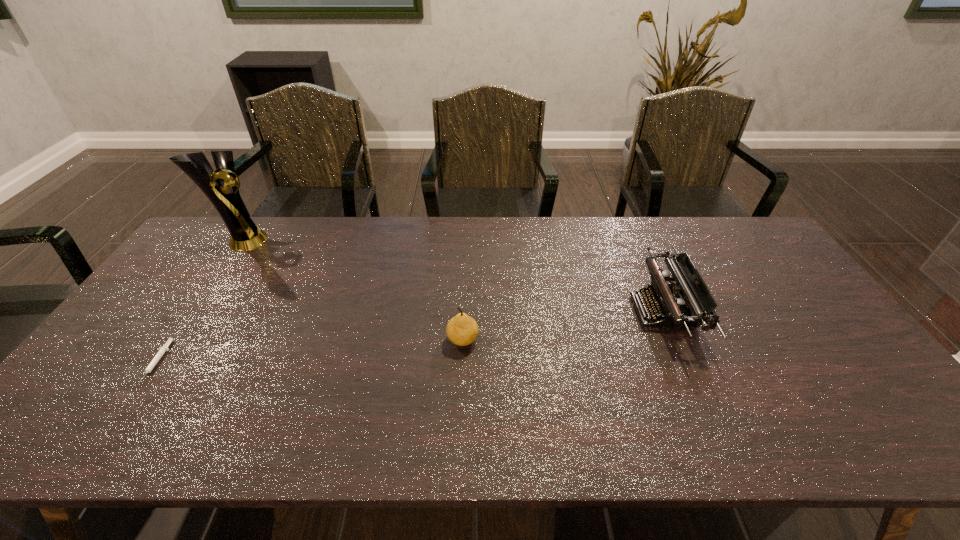
The image size is (960, 540). What are the coordinates of `award` in the screenshot? It's located at (244, 235).

What are the coordinates of `the tallest object` in the screenshot? It's located at pyautogui.click(x=244, y=235).

Locate an element on the screen. the rightmost object is located at coordinates (667, 298).

Where is `pear`? The width and height of the screenshot is (960, 540). pear is located at coordinates (462, 330).

Identify the location of syringe. The image size is (960, 540). (162, 350).

What are the coordinates of `free space located at the front of the tallest object, where the globe is visible` in the screenshot? It's located at (290, 241).

Where is `vacant space situated 0.070m on the typing side of the rightmost object`? vacant space situated 0.070m on the typing side of the rightmost object is located at coordinates (611, 311).

Locate an element on the screen. free space located 0.380m on the typing side of the rightmost object is located at coordinates (501, 311).

At what (x,y) coordinates should I click in order to perform the action: click on vacant space located on the typing side of the rightmost object. Please return your answer as a coordinate pair (x, y). This screenshot has width=960, height=540. Looking at the image, I should click on (512, 311).

Locate an element on the screen. vacant area situated 0.270m on the left of the pear is located at coordinates (346, 340).